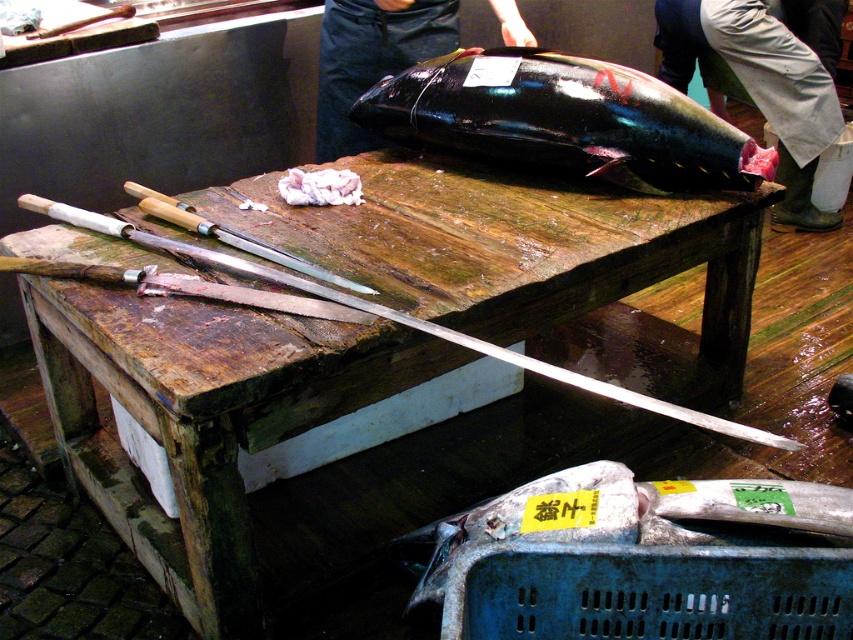
Is shiny black fish at center bigger than shiny metal knife at upper center?

Indeed, shiny black fish at center has a larger size compared to shiny metal knife at upper center.

Is shiny black fish at center taller than shiny metal knife at upper center?

Yes, shiny black fish at center is taller than shiny metal knife at upper center.

This screenshot has height=640, width=853. What do you see at coordinates (564, 120) in the screenshot? I see `shiny black fish at center` at bounding box center [564, 120].

The width and height of the screenshot is (853, 640). Identify the location of shiny black fish at center. (564, 120).

Is point (642, 330) closer to camera compared to point (469, 141)?

No, (642, 330) is further to viewer.

Is point (120, 339) positioned before point (421, 128)?

Yes, point (120, 339) is in front of point (421, 128).

The width and height of the screenshot is (853, 640). I want to click on wooden cutting board at center, so click(x=202, y=417).

Which is in front, point (219, 532) or point (343, 150)?

Point (219, 532)

Can you confirm if wooden cutting board at center is positioned above glossy black fish at upper center?

No, wooden cutting board at center is not above glossy black fish at upper center.

Does point (392, 291) lie in front of point (357, 20)?

Yes.

Locate an element on the screen. wooden cutting board at center is located at coordinates (202, 417).